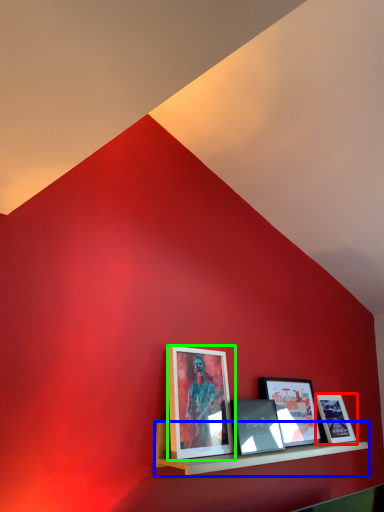
Question: Estimate the real-world distances between objects in this image. Which object is closer to picture frame (highlighted by a red box), shelf (highlighted by a blue box) or picture frame (highlighted by a green box)?

Choices:
 (A) shelf
 (B) picture frame

Answer: (A)